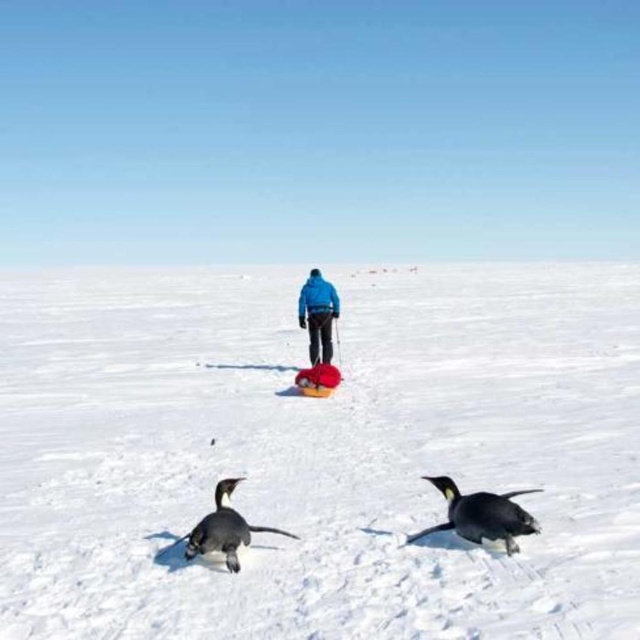
Measure the distance from white fluffy snow at center to blue fabric jacket at center.

white fluffy snow at center is 8.12 meters away from blue fabric jacket at center.

The height and width of the screenshot is (640, 640). I want to click on white fluffy snow at center, so click(317, 452).

Measure the distance between white fluffy snow at center and camera.

white fluffy snow at center is 4.04 meters from camera.

Find the location of `white fluffy snow at center`. white fluffy snow at center is located at coordinates (317, 452).

Is black glossy penguin at lower left to the right of blue fabric jacket at center from the viewer's perspective?

Incorrect, black glossy penguin at lower left is not on the right side of blue fabric jacket at center.

Is black glossy penguin at lower left wider than blue fabric jacket at center?

Incorrect, black glossy penguin at lower left's width does not surpass blue fabric jacket at center's.

Between point (236, 554) and point (314, 339), which one is positioned behind?

Point (314, 339)

Find the location of `black glossy penguin at lower left`. black glossy penguin at lower left is located at coordinates (224, 529).

Based on the photo, can you confirm if white fluffy snow at center is positioned below black matte penguin at lower right?

No.

Does white fluffy snow at center lie behind black matte penguin at lower right?

No, it is in front of black matte penguin at lower right.

Who is more forward, (492, 609) or (531, 515)?

Point (492, 609)

Locate an element on the screen. The image size is (640, 640). white fluffy snow at center is located at coordinates 317,452.